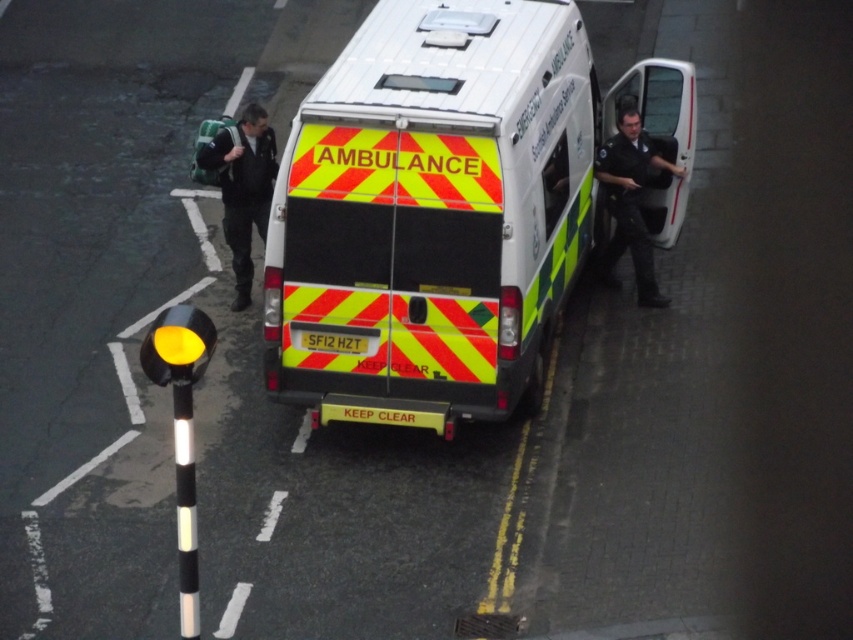
Is white glossy ambulance at center behind dark blue uniform at right?

No, white glossy ambulance at center is in front of dark blue uniform at right.

Does white glossy ambulance at center appear on the left side of dark blue uniform at right?

Indeed, white glossy ambulance at center is positioned on the left side of dark blue uniform at right.

The width and height of the screenshot is (853, 640). Describe the element at coordinates (433, 212) in the screenshot. I see `white glossy ambulance at center` at that location.

The width and height of the screenshot is (853, 640). Identify the location of white glossy ambulance at center. (433, 212).

Who is more forward, (263, 125) or (621, 144)?

Point (263, 125)

Who is higher up, dark green backpack at upper left or dark blue uniform at right?

dark blue uniform at right is higher up.

Describe the element at coordinates (242, 188) in the screenshot. The image size is (853, 640). I see `dark green backpack at upper left` at that location.

Locate an element on the screen. The image size is (853, 640). dark green backpack at upper left is located at coordinates (242, 188).

Based on the photo, is white glossy ambulance at center thinner than dark green backpack at upper left?

No, white glossy ambulance at center is not thinner than dark green backpack at upper left.

Can you confirm if white glossy ambulance at center is positioned to the left of dark green backpack at upper left?

No, white glossy ambulance at center is not to the left of dark green backpack at upper left.

Is point (287, 227) positioned before point (215, 138)?

Yes, point (287, 227) is in front of point (215, 138).

Find the location of a particular element. white glossy ambulance at center is located at coordinates (433, 212).